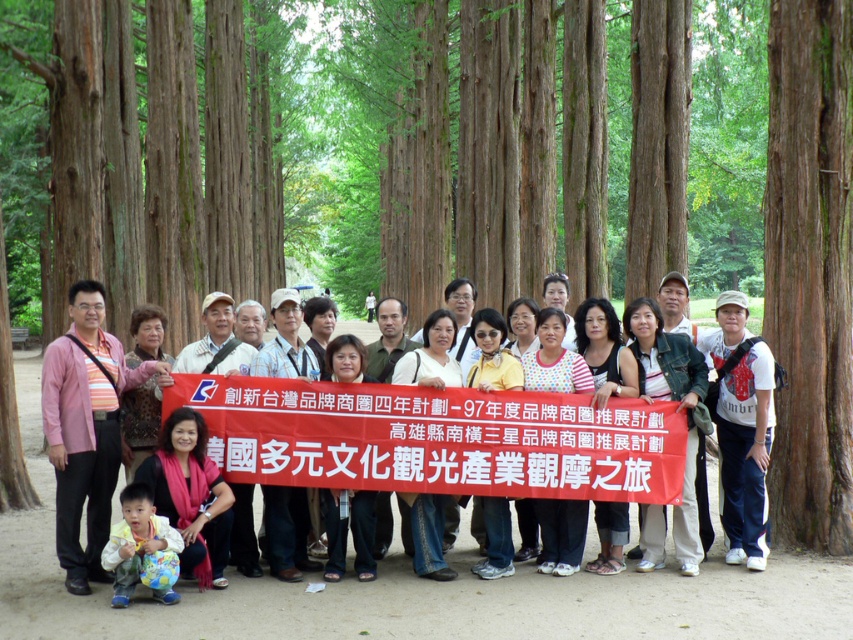
Based on the photo, you are a photographer trying to capture a group photo in the park. You notice the matte yellow sign at center and the light blue fabric at lower left. Which object should you position closer to the camera to ensure both are visible in the frame?

You should position the light blue fabric at lower left closer to the camera because the matte yellow sign at center is already to the right of it, so moving the light blue fabric at lower left forward will keep both within the frame.

You are a photographer trying to capture the entire group holding the matte yellow sign at center and the white cotton shirt at center in a single frame. Based on their sizes, do you think you can fit both objects comfortably within the camera view without cropping either of them?

The matte yellow sign at center might be wider than white cotton shirt at center, so it depends on the camera view size. If the camera can accommodate the width of the wider matte yellow sign at center, then both should fit.